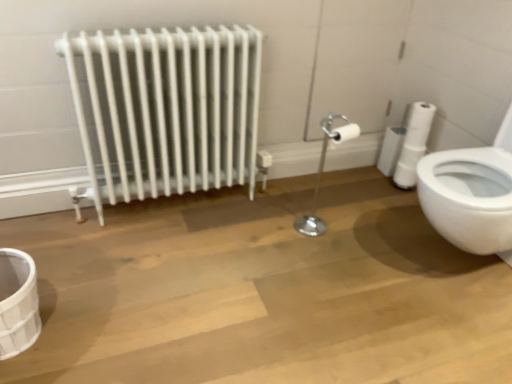
The image size is (512, 384). What are the coordinates of `free space in front of white metallic radiator at left` in the screenshot? It's located at (172, 273).